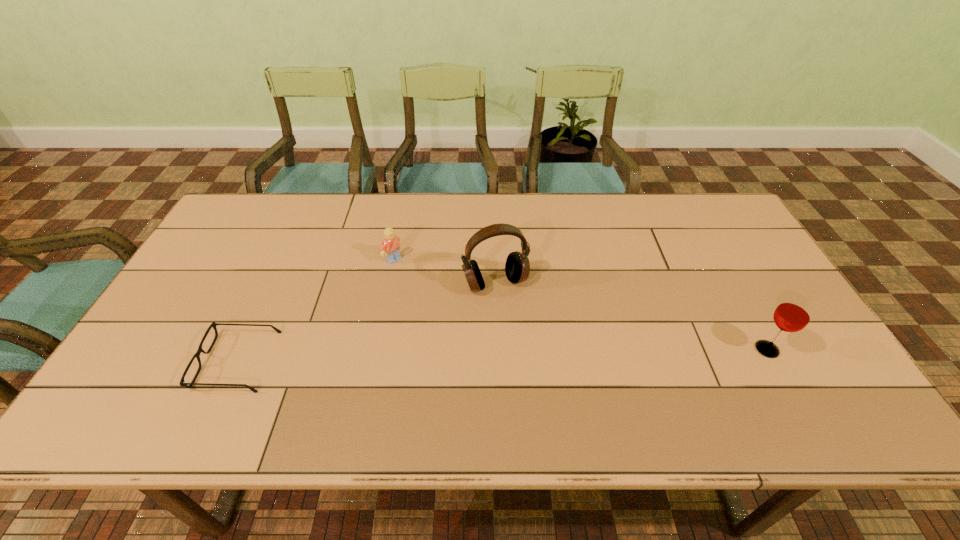
The width and height of the screenshot is (960, 540). I want to click on free spot located 0.370m on the back of the rightmost object, so click(708, 243).

Identify the location of vacant region located 0.170m on the ear pads of the second object from right to left. This screenshot has width=960, height=540. (526, 347).

Identify the location of vacant area located 0.300m on the ear pads of the second object from right to left. This screenshot has width=960, height=540. (545, 392).

Where is `vacant area located on the ear pads of the second object from right to left`? The image size is (960, 540). vacant area located on the ear pads of the second object from right to left is located at coordinates (535, 367).

The height and width of the screenshot is (540, 960). Find the location of `vacant space located 0.190m on the front-facing side of the farthest object`. vacant space located 0.190m on the front-facing side of the farthest object is located at coordinates (x=441, y=299).

Find the location of a particular element. This screenshot has width=960, height=540. free space located on the front-facing side of the farthest object is located at coordinates (415, 276).

Find the location of `free space located 0.340m on the front-facing side of the farthest object`. free space located 0.340m on the front-facing side of the farthest object is located at coordinates (478, 330).

Locate an element on the screen. This screenshot has height=540, width=960. spectacles located at the near edge is located at coordinates (182, 383).

The image size is (960, 540). I want to click on glass located in the near edge section of the desktop, so click(x=793, y=314).

Where is `object that is at the right edge`? Image resolution: width=960 pixels, height=540 pixels. object that is at the right edge is located at coordinates (793, 314).